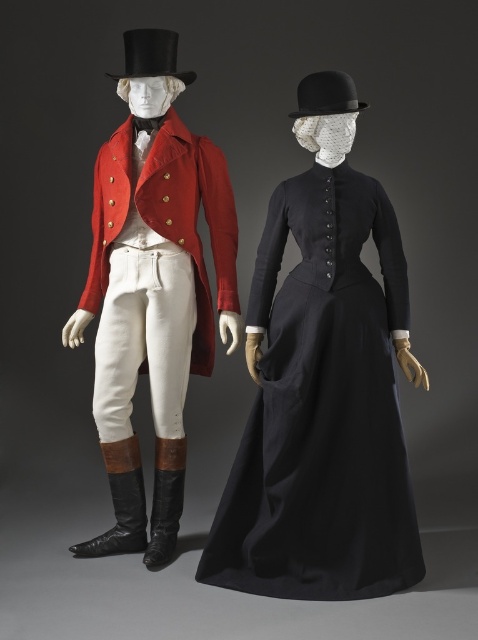
Question: Estimate the real-world distances between objects in this image. Which object is farther from the matte black dress at center?

Choices:
 (A) leather at center
 (B) black felt bowler hat at upper center

Answer: (B)

Question: Which point is closer to the camera?

Choices:
 (A) (310, 90)
 (B) (133, 532)
 (C) (214, 253)

Answer: (A)

Question: Is the position of matte red coat at center more distant than that of black felt top hat at upper center?

Choices:
 (A) yes
 (B) no

Answer: (B)

Question: Which is farther from the black felt bowler hat at upper center?

Choices:
 (A) brown leather boot at lower left
 (B) black felt top hat at upper center
 (C) leather at center

Answer: (A)

Question: Is matte red coat at left positioned before brown leather boot at lower left?

Choices:
 (A) no
 (B) yes

Answer: (B)

Question: Is matte red coat at center positioned before matte red coat at left?

Choices:
 (A) yes
 (B) no

Answer: (A)